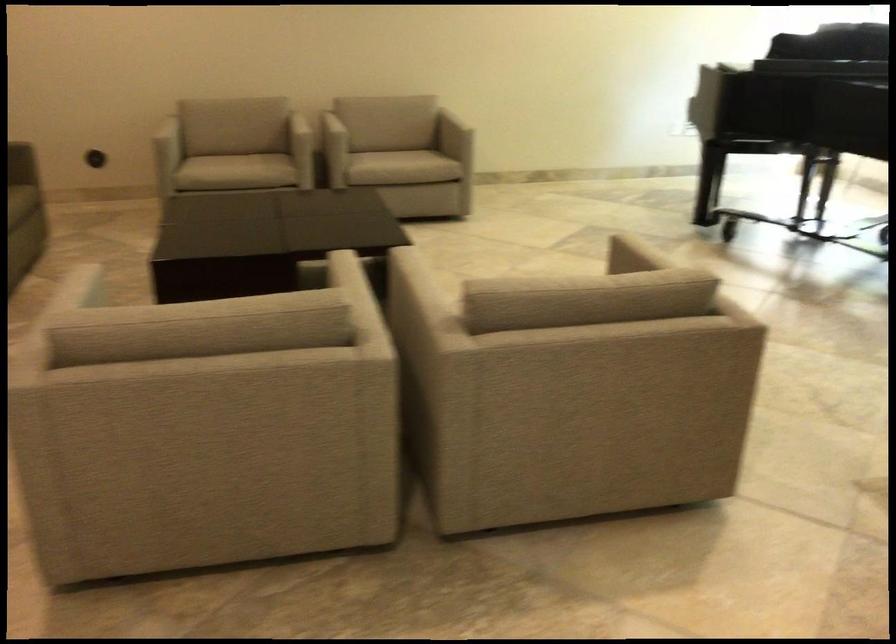
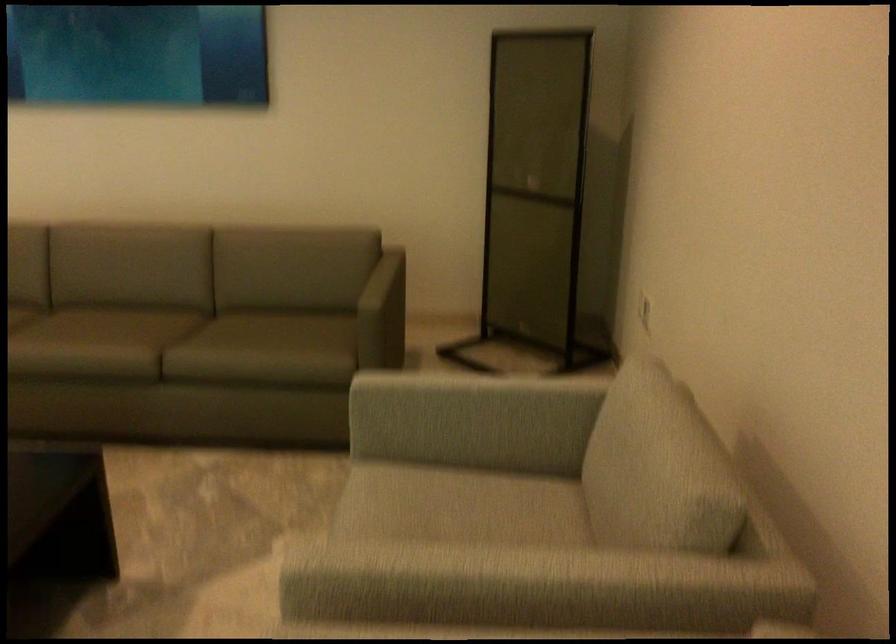
Where in the second image is the point corresponding to pixel 294 118 from the first image?

(479, 573)